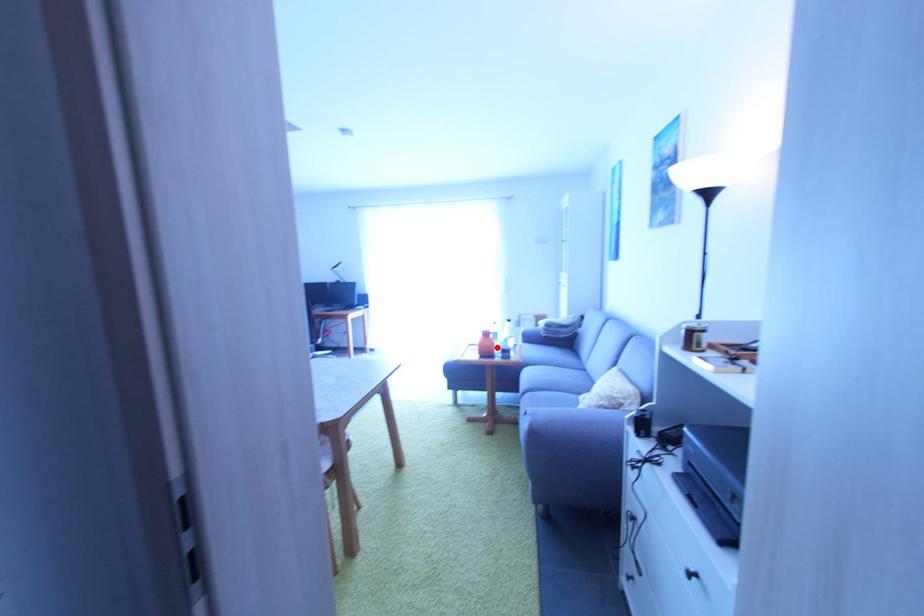
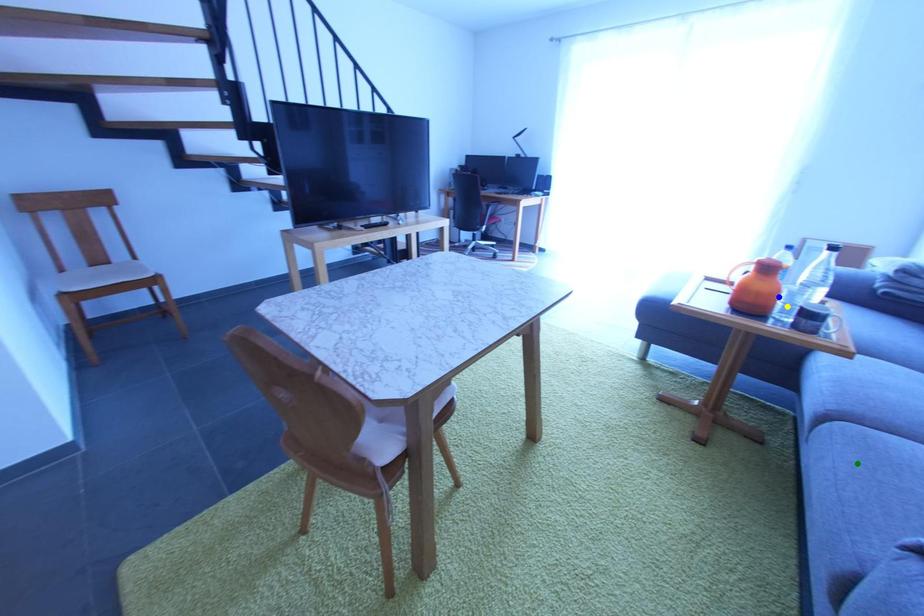
Question: I am providing you with two images of the same scene from different viewpoints. A red point is marked on the first image. You are given multiple points on the second image. Can you choose the point in image 2 that corresponds to the point in image 1?

Choices:
 (A) yellow point
 (B) blue point
 (C) green point

Answer: (B)